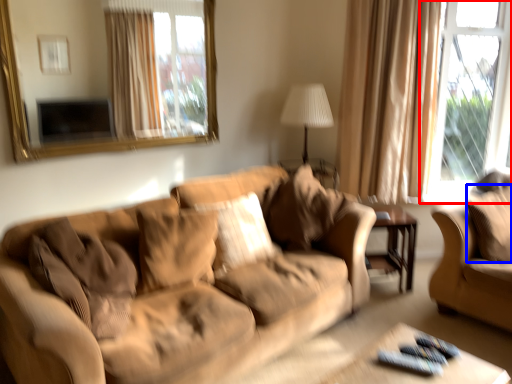
Question: Which point is further to the camera, window (highlighted by a red box) or pillow (highlighted by a blue box)?

Choices:
 (A) window
 (B) pillow

Answer: (A)